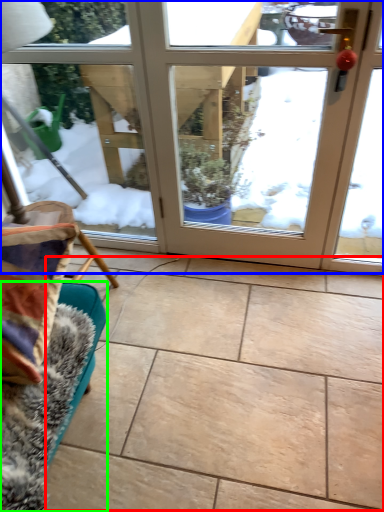
Question: Which object is the farthest from ceramic tile (highlighted by a red box)? Choose among these: door (highlighted by a blue box) or furniture (highlighted by a green box).

Choices:
 (A) door
 (B) furniture

Answer: (A)